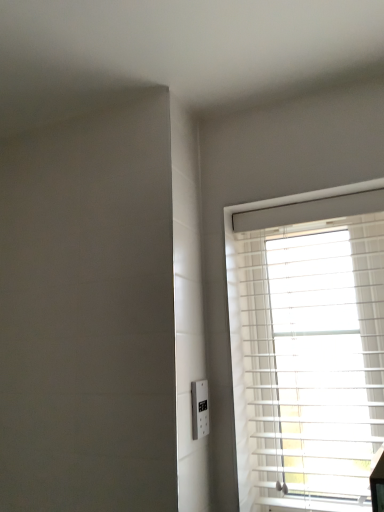
Question: Is white plastic electric outlet at lower right in front of white plastic blinds at right?

Choices:
 (A) no
 (B) yes

Answer: (A)

Question: Does white plastic electric outlet at lower right have a greater height compared to white plastic blinds at right?

Choices:
 (A) yes
 (B) no

Answer: (B)

Question: Does white plastic electric outlet at lower right appear on the right side of white plastic blinds at right?

Choices:
 (A) no
 (B) yes

Answer: (A)

Question: Is white plastic electric outlet at lower right oriented towards white plastic blinds at right?

Choices:
 (A) yes
 (B) no

Answer: (B)

Question: From a real-world perspective, is white plastic electric outlet at lower right under white plastic blinds at right?

Choices:
 (A) yes
 (B) no

Answer: (A)

Question: From the image's perspective, would you say white plastic electric outlet at lower right is shown under white plastic blinds at right?

Choices:
 (A) no
 (B) yes

Answer: (B)

Question: From a real-world perspective, is white plastic blinds at right physically above white plastic electric outlet at lower right?

Choices:
 (A) no
 (B) yes

Answer: (B)

Question: Is white plastic electric outlet at lower right surrounded by white plastic blinds at right?

Choices:
 (A) no
 (B) yes

Answer: (A)

Question: Is white plastic blinds at right completely or partially outside of white plastic electric outlet at lower right?

Choices:
 (A) no
 (B) yes

Answer: (B)

Question: From the image's perspective, would you say white plastic blinds at right is shown under white plastic electric outlet at lower right?

Choices:
 (A) yes
 (B) no

Answer: (B)

Question: Considering the relative sizes of white plastic blinds at right and white plastic electric outlet at lower right in the image provided, is white plastic blinds at right thinner than white plastic electric outlet at lower right?

Choices:
 (A) yes
 (B) no

Answer: (B)

Question: Can you confirm if white plastic blinds at right is smaller than white plastic electric outlet at lower right?

Choices:
 (A) yes
 (B) no

Answer: (B)

Question: Visually, is white plastic blinds at right positioned to the left or to the right of white plastic electric outlet at lower right?

Choices:
 (A) left
 (B) right

Answer: (B)